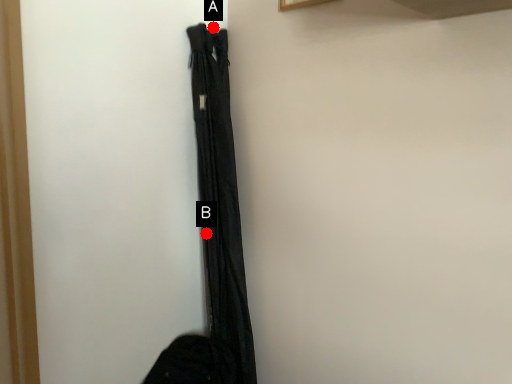
Question: Two points are circled on the image, labeled by A and B beside each circle. Which of the following is the farthest from the observer?

Choices:
 (A) A is further
 (B) B is further

Answer: (B)